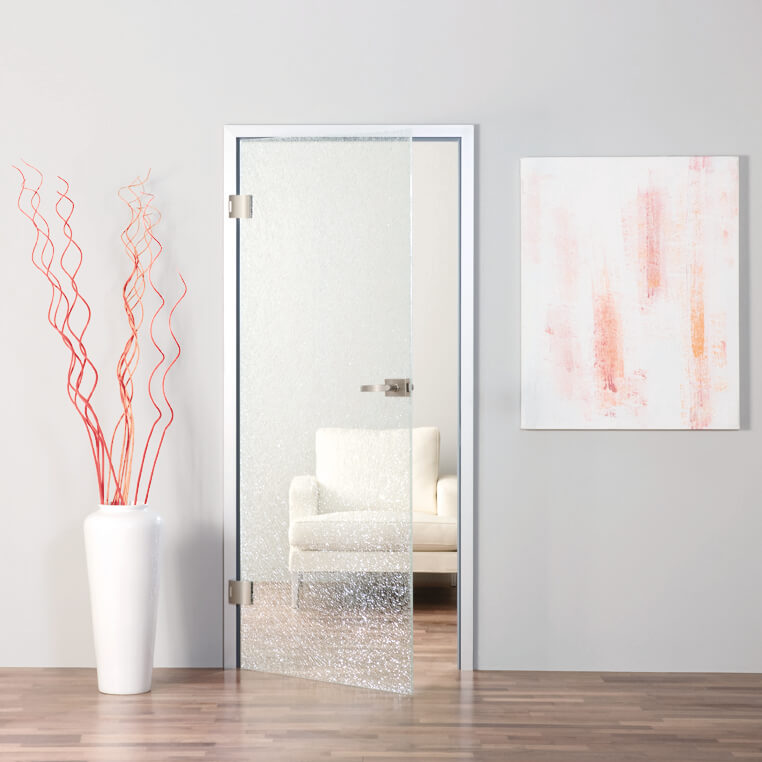
The width and height of the screenshot is (762, 762). I want to click on cushion, so click(375, 527), click(373, 469).